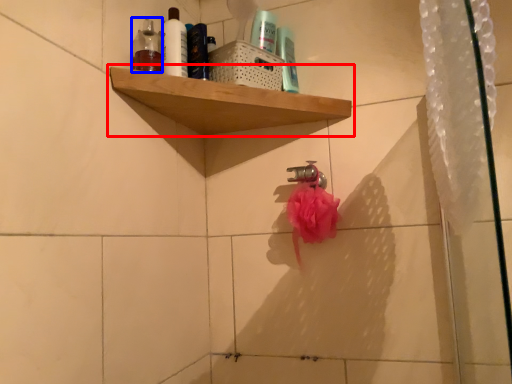
Question: Which point is further to the camera, shelf (highlighted by a red box) or toiletry (highlighted by a blue box)?

Choices:
 (A) shelf
 (B) toiletry

Answer: (B)